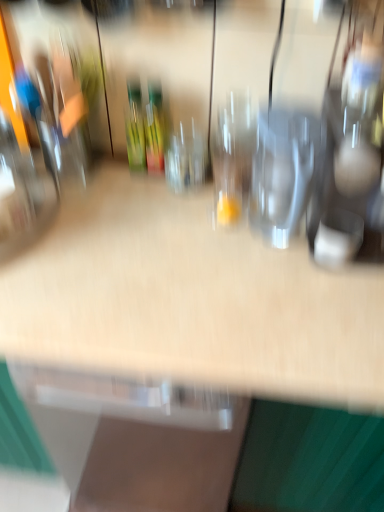
Question: Does point 137,138 appear closer or farther from the camera than point 157,160?

Choices:
 (A) farther
 (B) closer

Answer: (B)

Question: Looking at the image, does green glass bottle at center seem bigger or smaller compared to green glass wine bottle at center?

Choices:
 (A) small
 (B) big

Answer: (A)

Question: Estimate the real-world distances between objects in this image. Which object is closer to the transparent glass wine glass at center, which is the 3th wine glass from right to left?

Choices:
 (A) green glass bottle at center
 (B) transparent glass wine glass at center, the 1th wine glass viewed from the right
 (C) transparent glass at center, which appears as the second wine glass when viewed from the left
 (D) green glass wine bottle at center

Answer: (D)

Question: Which of these objects is positioned farthest from the transparent glass wine glass at center, acting as the third wine glass starting from the left?

Choices:
 (A) green glass bottle at center
 (B) green glass wine bottle at center
 (C) transparent glass at center, which appears as the second wine glass when viewed from the left
 (D) transparent glass wine glass at center, which is the 3th wine glass from right to left

Answer: (A)